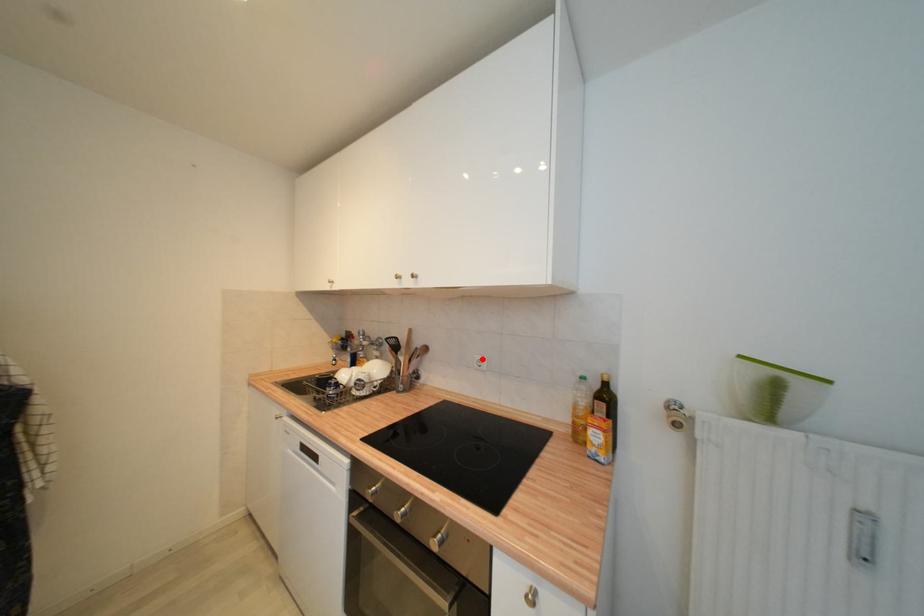
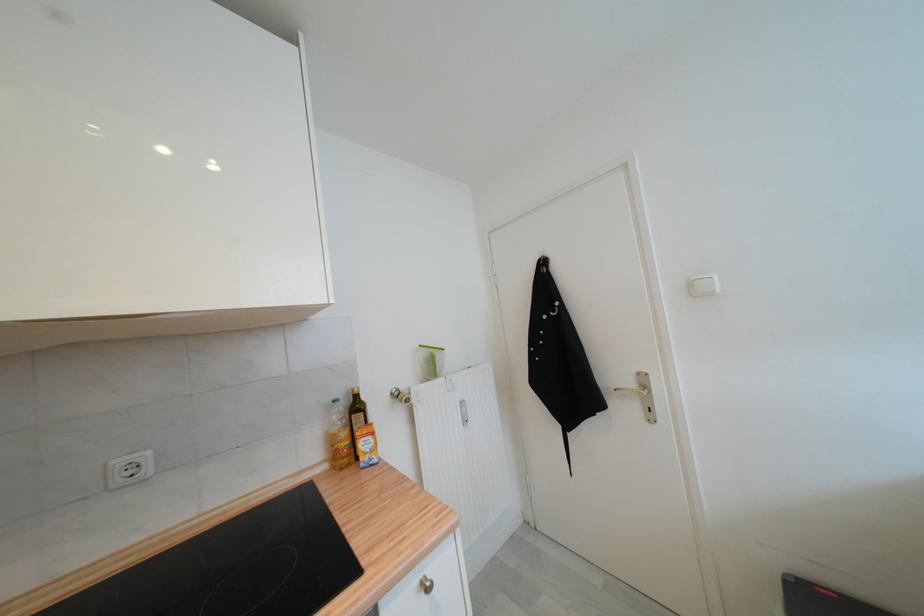
In the second image, find the point that corresponds to the highlighted location in the first image.

(126, 464)